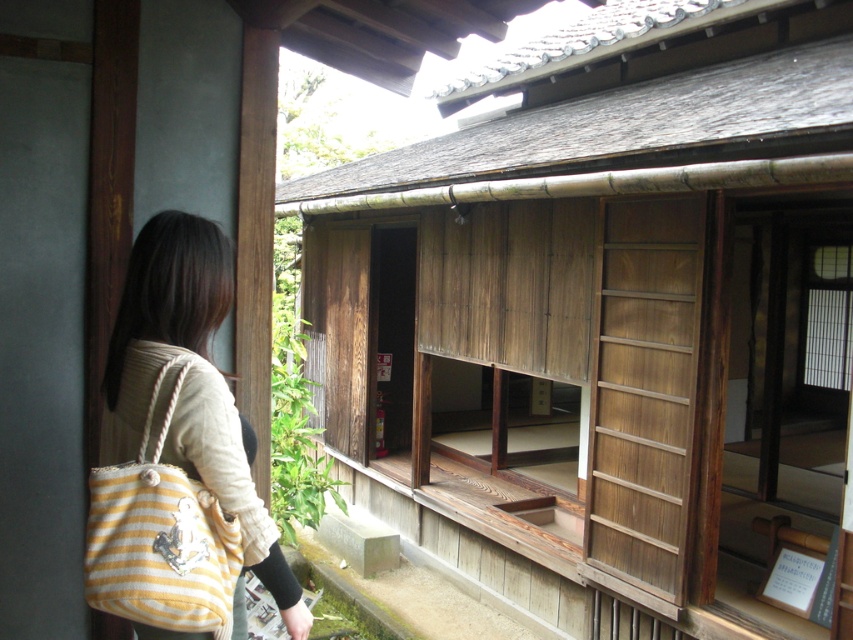
Based on the scene description, where is the wooden sliding door at center located in terms of its 2D coordinates?

The wooden sliding door at center is located at the 2D coordinates of point [607,320].

You are visiting a traditional Japanese building and notice the wooden sliding door at center and the yellow striped fabric shoulder bag at left. Which object is shorter in height?

The wooden sliding door at center is not as tall as the yellow striped fabric shoulder bag at left, so the wooden sliding door at center is shorter in height.